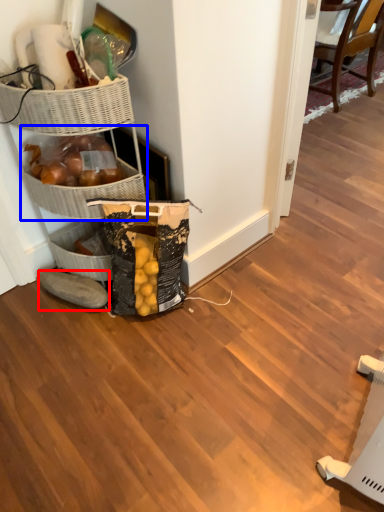
Question: Which of the following is the farthest to the observer, footwear (highlighted by a red box) or basket (highlighted by a blue box)?

Choices:
 (A) footwear
 (B) basket

Answer: (A)